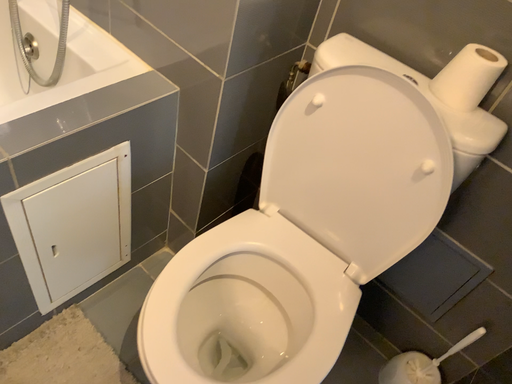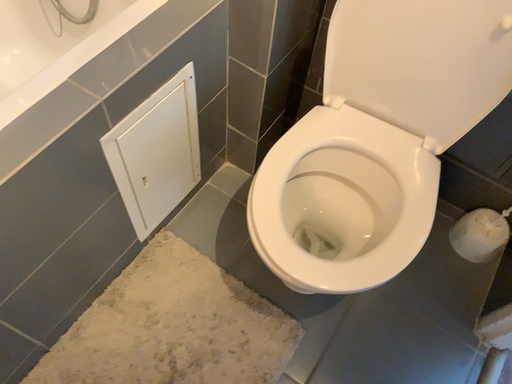
Question: How did the camera likely rotate when shooting the video?

Choices:
 (A) rotated downward
 (B) rotated upward

Answer: (A)